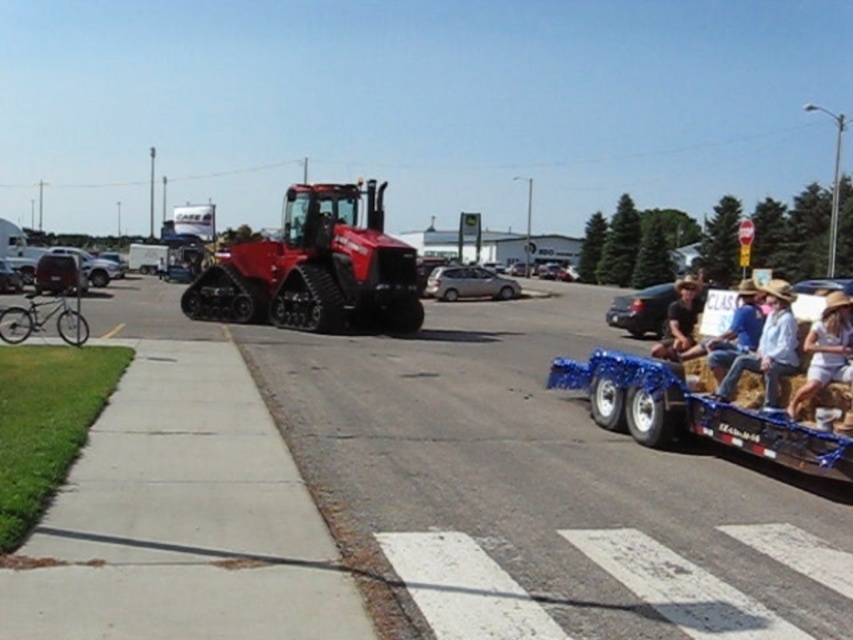
What do you see at coordinates (642, 308) in the screenshot?
I see `matte black car at right` at bounding box center [642, 308].

Is point (693, 317) closer to viewer compared to point (688, 296)?

No.

Which is in front, point (630, 298) or point (698, 285)?

Point (698, 285)

This screenshot has width=853, height=640. Find the location of `matte black car at right`. matte black car at right is located at coordinates (642, 308).

Can you confirm if denim jacket at center is bigger than matte black car at center?

No, denim jacket at center is not bigger than matte black car at center.

Consider the image. Which is above, denim jacket at center or matte black car at center?

matte black car at center

Between point (724, 392) and point (88, 252), which one is positioned in front?

Point (724, 392)

Find the location of a particular element. Image resolution: width=853 pixels, height=640 pixels. denim jacket at center is located at coordinates (769, 348).

This screenshot has width=853, height=640. What do you see at coordinates (735, 330) in the screenshot?
I see `blue denim shirt at right` at bounding box center [735, 330].

Image resolution: width=853 pixels, height=640 pixels. I want to click on blue denim shirt at right, so click(x=735, y=330).

The height and width of the screenshot is (640, 853). What are the coordinates of `blue denim shirt at right` in the screenshot? It's located at pyautogui.click(x=735, y=330).